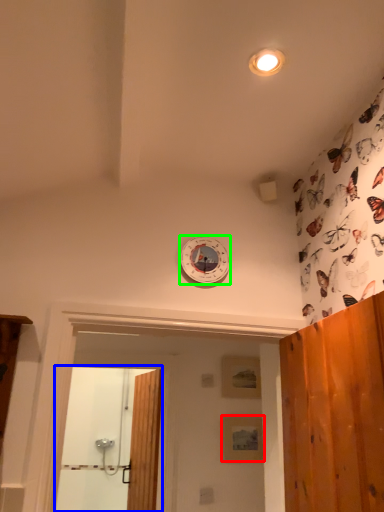
Question: Based on their relative distances, which object is nearer to panel (highlighted by a red box)? Choose from screen door (highlighted by a blue box) and clock (highlighted by a green box).

Choices:
 (A) screen door
 (B) clock

Answer: (B)